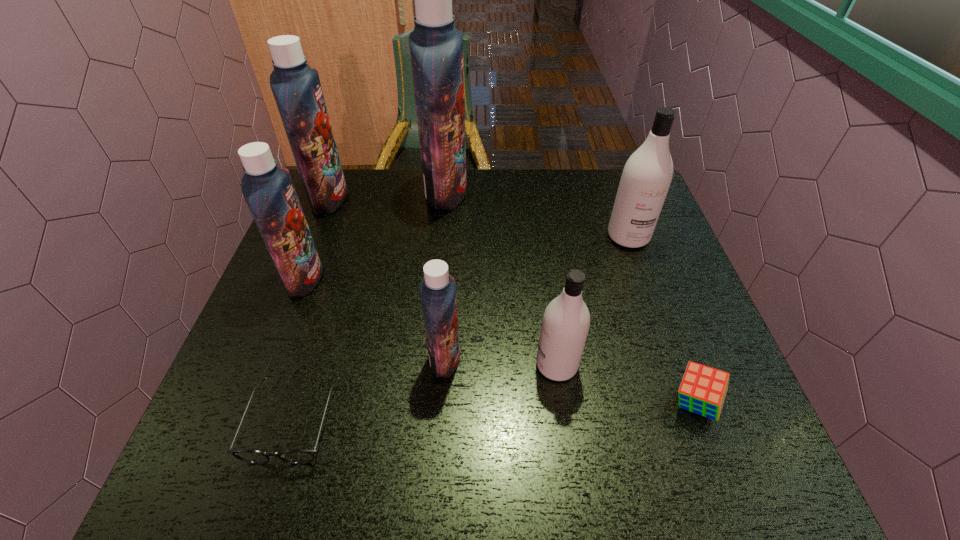
The width and height of the screenshot is (960, 540). Identify the location of the tallest object. (x=436, y=47).

Locate an element on the screen. This screenshot has height=540, width=960. the tallest shampoo is located at coordinates (436, 47).

Where is `the second tallest shampoo`? the second tallest shampoo is located at coordinates (296, 87).

Locate an element on the screen. the seventh shortest object is located at coordinates (296, 87).

Find the location of a particular element. This screenshot has width=960, height=540. the second nearest blue shampoo is located at coordinates click(269, 192).

Identify the location of the fifth nearest object. This screenshot has width=960, height=540. (269, 192).

Find the location of a particular element. the right white shampoo is located at coordinates (647, 175).

The image size is (960, 540). Identify the location of the fourth nearest shampoo. (647, 175).

What are the coordinates of `the smallest blue shampoo` in the screenshot? It's located at (437, 289).

Image resolution: width=960 pixels, height=540 pixels. I want to click on the smaller white shampoo, so click(566, 320).